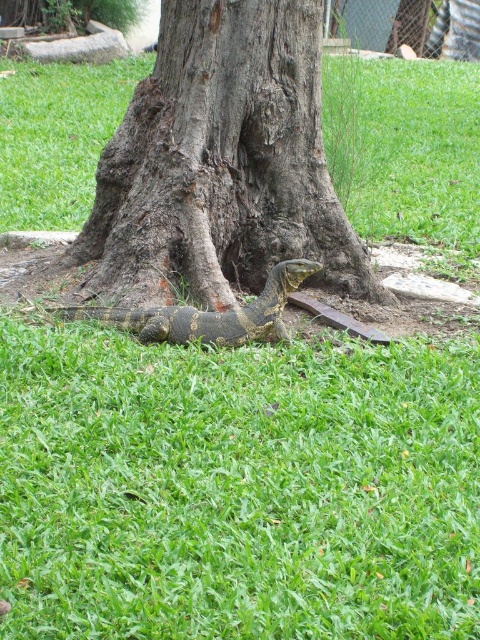
Is brown rough bark tree at center bigger than yellow-green scaly lizard at lower center?

Yes, brown rough bark tree at center is bigger than yellow-green scaly lizard at lower center.

The image size is (480, 640). I want to click on brown rough bark tree at center, so click(x=220, y=164).

This screenshot has width=480, height=640. What are the coordinates of `brown rough bark tree at center` in the screenshot? It's located at (220, 164).